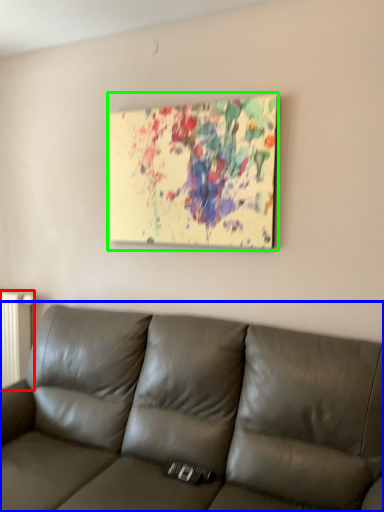
Question: Estimate the real-world distances between objects in this image. Which object is farther from radiator (highlighted by a red box), studio couch (highlighted by a blue box) or picture frame (highlighted by a green box)?

Choices:
 (A) studio couch
 (B) picture frame

Answer: (B)